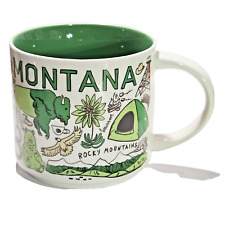
The height and width of the screenshot is (225, 225). I want to click on shadow of coffee cup handle, so click(x=190, y=175).